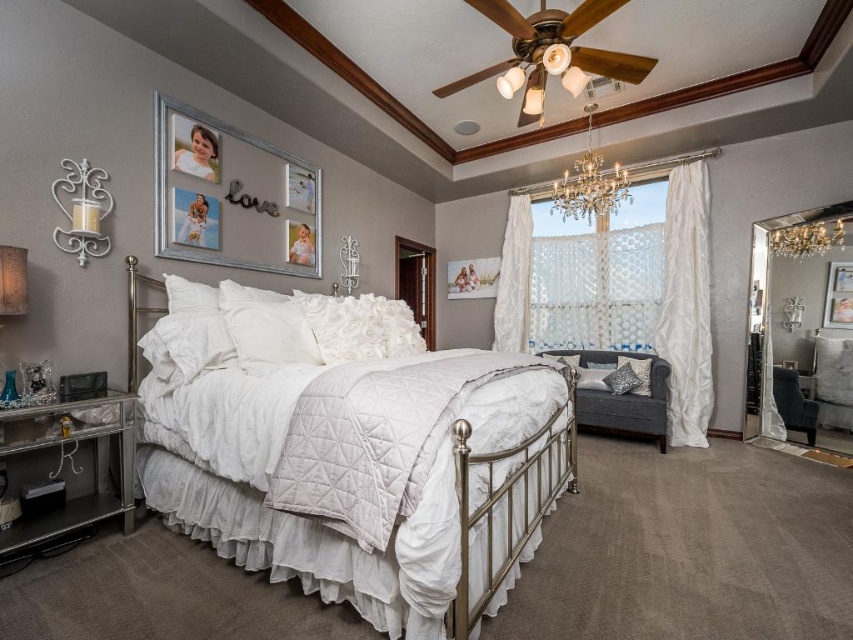
Question: Can you confirm if matte gold ceiling fan at upper center is positioned to the right of crystal glass chandelier at upper right?

Choices:
 (A) yes
 (B) no

Answer: (B)

Question: Can you confirm if silver metallic picture frame at upper left is smaller than silver metallic pillow at lower right?

Choices:
 (A) no
 (B) yes

Answer: (A)

Question: Is white textured curtain at right to the right of metallic silver picture frame at upper right from the viewer's perspective?

Choices:
 (A) yes
 (B) no

Answer: (B)

Question: Among these objects, which one is farthest from the camera?

Choices:
 (A) crystal glass chandelier at upper right
 (B) white quilted fabric bed at center

Answer: (A)

Question: Estimate the real-world distances between objects in this image. Which object is farther from the metallic silver picture frame at upper right?

Choices:
 (A) white textured curtain at right
 (B) white textured pillow at lower right
 (C) matte gold ceiling fan at upper center

Answer: (C)

Question: Estimate the real-world distances between objects in this image. Which object is farther from the white textured curtain at right?

Choices:
 (A) white lace curtains at upper right
 (B) silver metallic pillow at lower right
 (C) white textured pillow at lower right
 (D) matte gold ceiling fan at upper center

Answer: (D)